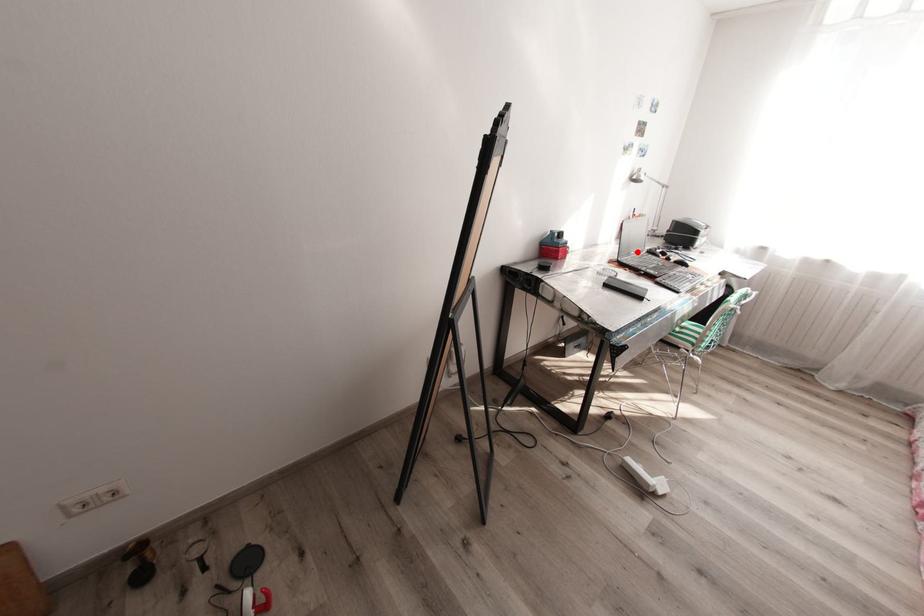
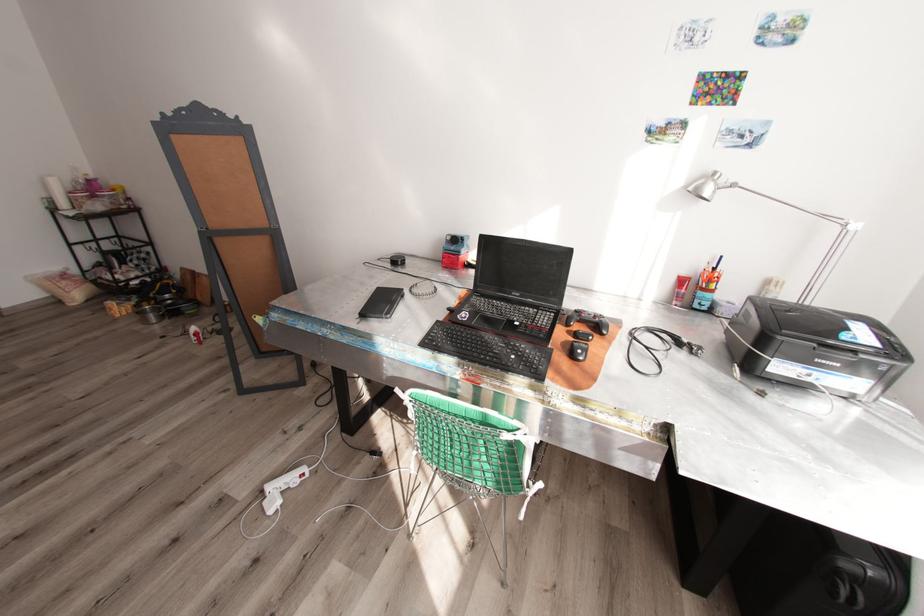
Locate, in the second image, the point that corresponds to the highlighted location in the first image.

(523, 294)